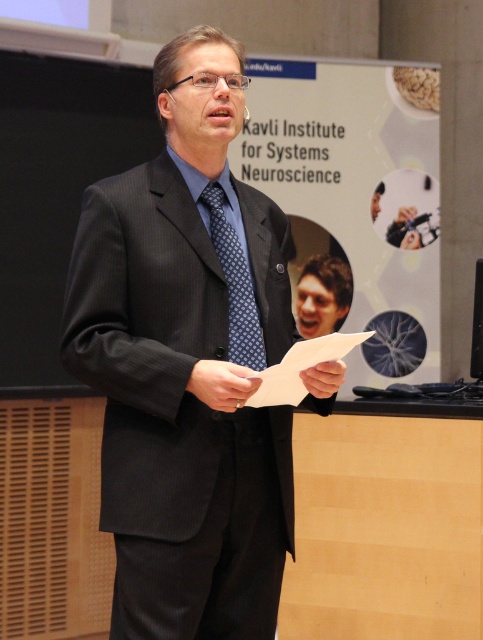
Question: Which of the following is the farthest from the observer?

Choices:
 (A) (255, 316)
 (B) (302, 333)
 (C) (216, 397)

Answer: (B)

Question: Does black pinstripe suit at center come in front of blue dotted tie at center?

Choices:
 (A) no
 (B) yes

Answer: (B)

Question: Can you confirm if black pinstripe suit at center is thinner than blue dotted tie at center?

Choices:
 (A) no
 (B) yes

Answer: (A)

Question: Does black pinstripe suit at center appear on the right side of blue dotted tie at center?

Choices:
 (A) yes
 (B) no

Answer: (B)

Question: Which of the following is the farthest from the observer?

Choices:
 (A) (325, 320)
 (B) (228, 266)

Answer: (A)

Question: Which object is closer to the camera taking this photo?

Choices:
 (A) blue dotted tie at center
 (B) brown hair at center

Answer: (A)